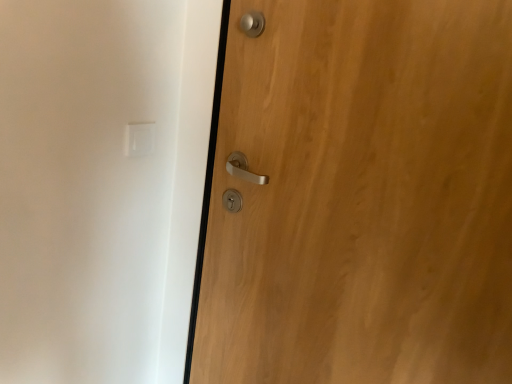
The image size is (512, 384). What do you see at coordinates (139, 139) in the screenshot? I see `white plastic light switch at upper left` at bounding box center [139, 139].

Measure the distance between point (133, 152) and camera.

1.09 meters.

Where is `white plastic light switch at upper left`? white plastic light switch at upper left is located at coordinates (139, 139).

I want to click on wooden door at right, so pyautogui.click(x=362, y=197).

This screenshot has height=384, width=512. Describe the element at coordinates (362, 197) in the screenshot. I see `wooden door at right` at that location.

Where is `white plastic light switch at upper left`? The image size is (512, 384). white plastic light switch at upper left is located at coordinates (139, 139).

Considering the positions of objects white plastic light switch at upper left and wooden door at right in the image provided, who is more to the left, white plastic light switch at upper left or wooden door at right?

From the viewer's perspective, white plastic light switch at upper left appears more on the left side.

In the image, is white plastic light switch at upper left positioned in front of or behind wooden door at right?

white plastic light switch at upper left is behind wooden door at right.

Between point (140, 134) and point (336, 133), which one is positioned in front?

The point (336, 133) is closer.

From the image's perspective, would you say white plastic light switch at upper left is positioned over wooden door at right?

Indeed, from the image's perspective, white plastic light switch at upper left is shown above wooden door at right.

From a real-world perspective, is white plastic light switch at upper left located higher than wooden door at right?

Yes.

Can you confirm if white plastic light switch at upper left is thinner than wooden door at right?

Yes, white plastic light switch at upper left is thinner than wooden door at right.

Considering the relative sizes of white plastic light switch at upper left and wooden door at right in the image provided, is white plastic light switch at upper left taller than wooden door at right?

Incorrect, the height of white plastic light switch at upper left is not larger of that of wooden door at right.

Can you confirm if white plastic light switch at upper left is bigger than wooden door at right?

No, white plastic light switch at upper left is not bigger than wooden door at right.

Is white plastic light switch at upper left inside the boundaries of wooden door at right, or outside?

white plastic light switch at upper left exists outside the volume of wooden door at right.

Is white plastic light switch at upper left next to wooden door at right and touching it?

No, white plastic light switch at upper left is not next to wooden door at right.

Is white plastic light switch at upper left oriented away from wooden door at right?

white plastic light switch at upper left is not turned away from wooden door at right.

Locate an element on the screen. This screenshot has width=512, height=384. door located below the white plastic light switch at upper left (from the image's perspective) is located at coordinates (362, 197).

Between wooden door at right and white plastic light switch at upper left, which one appears on the right side from the viewer's perspective?

wooden door at right is more to the right.

Which is in front, wooden door at right or white plastic light switch at upper left?

wooden door at right is in front.

Considering the points (330, 270) and (145, 137), which point is behind, point (330, 270) or point (145, 137)?

The point (145, 137) is farther.

From the image's perspective, is wooden door at right under white plastic light switch at upper left?

Indeed, from the image's perspective, wooden door at right is shown beneath white plastic light switch at upper left.

From a real-world perspective, is wooden door at right beneath white plastic light switch at upper left?

Yes, from a real-world perspective, wooden door at right is below white plastic light switch at upper left.

Looking at their sizes, would you say wooden door at right is wider or thinner than white plastic light switch at upper left?

In the image, wooden door at right appears to be wider than white plastic light switch at upper left.

Who is taller, wooden door at right or white plastic light switch at upper left?

Standing taller between the two is wooden door at right.

Between wooden door at right and white plastic light switch at upper left, which one has larger size?

wooden door at right.

Can white plastic light switch at upper left be found inside wooden door at right?

A: Definitely not — white plastic light switch at upper left is not inside wooden door at right.

Is wooden door at right far away from white plastic light switch at upper left?

No, wooden door at right is not far from white plastic light switch at upper left.

Is wooden door at right facing towards white plastic light switch at upper left?

No.

What's the angular difference between wooden door at right and white plastic light switch at upper left's facing directions?

The angle between the facing direction of wooden door at right and the facing direction of white plastic light switch at upper left is 89.8 degrees.

Locate an element on the screen. light switch above the wooden door at right (from a real-world perspective) is located at coordinates (139, 139).

The width and height of the screenshot is (512, 384). What are the coordinates of `light switch on the left of wooden door at right` in the screenshot? It's located at (139, 139).

Where is `light switch lying above the wooden door at right (from the image's perspective)`? light switch lying above the wooden door at right (from the image's perspective) is located at coordinates (139, 139).